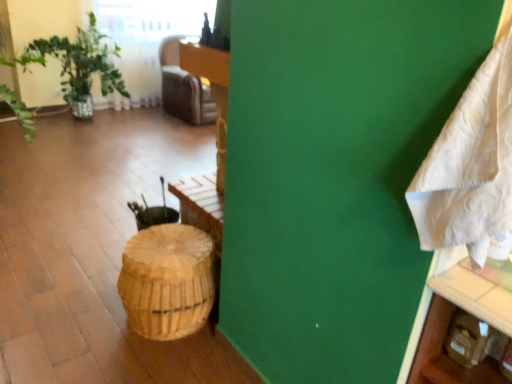
Question: Considering the relative sizes of brown woven basket at center and white textured blanket at right in the image provided, is brown woven basket at center taller than white textured blanket at right?

Choices:
 (A) no
 (B) yes

Answer: (A)

Question: Is brown woven basket at center outside white textured blanket at right?

Choices:
 (A) no
 (B) yes

Answer: (B)

Question: Does brown woven basket at center have a larger size compared to white textured blanket at right?

Choices:
 (A) yes
 (B) no

Answer: (A)

Question: Does brown woven basket at center contain white textured blanket at right?

Choices:
 (A) no
 (B) yes

Answer: (A)

Question: From the image's perspective, is brown woven basket at center over white textured blanket at right?

Choices:
 (A) yes
 (B) no

Answer: (B)

Question: Is the depth of brown woven basket at center greater than that of white textured blanket at right?

Choices:
 (A) yes
 (B) no

Answer: (A)

Question: Is white textured blanket at right closer to camera compared to brown woven basket at center?

Choices:
 (A) yes
 (B) no

Answer: (A)

Question: Is brown woven basket at center surrounded by white textured blanket at right?

Choices:
 (A) yes
 (B) no

Answer: (B)

Question: Considering the relative positions of white textured blanket at right and brown woven basket at center in the image provided, is white textured blanket at right to the left of brown woven basket at center from the viewer's perspective?

Choices:
 (A) no
 (B) yes

Answer: (A)

Question: Is white textured blanket at right outside of brown woven basket at center?

Choices:
 (A) yes
 (B) no

Answer: (A)

Question: Is white textured blanket at right wider than brown woven basket at center?

Choices:
 (A) no
 (B) yes

Answer: (A)

Question: From a real-world perspective, is white textured blanket at right over brown woven basket at center?

Choices:
 (A) no
 (B) yes

Answer: (B)

Question: Would you say white textured blanket at right is to the left or to the right of brown woven basket at center in the picture?

Choices:
 (A) left
 (B) right

Answer: (B)